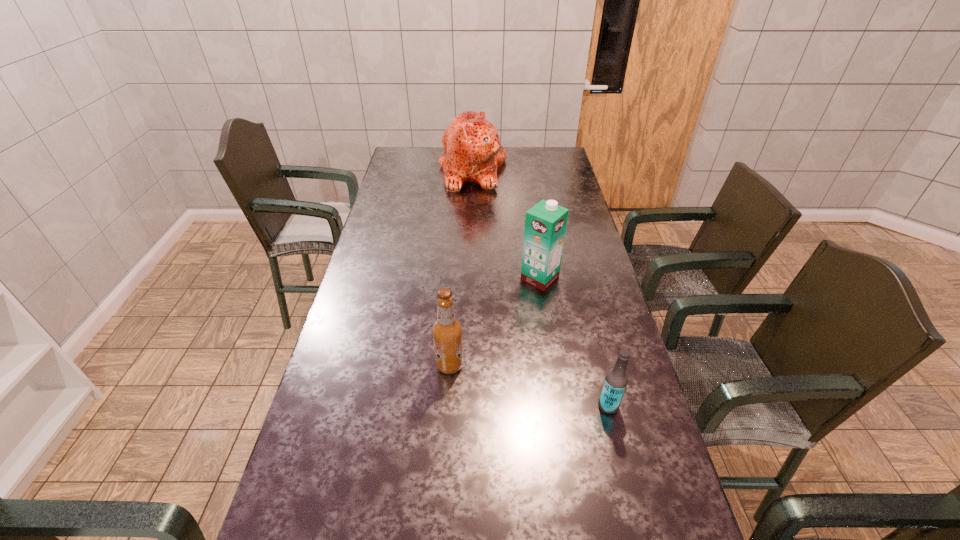
In order to click on empty location between the farthest object and the carton in this screenshot , I will do `click(506, 223)`.

The image size is (960, 540). I want to click on free space between the cat and the second nearest object, so click(x=461, y=267).

The height and width of the screenshot is (540, 960). I want to click on object that is the closest to the left beer bottle, so click(x=545, y=223).

Where is `object that can be found as the second closest to the rightmost object`? object that can be found as the second closest to the rightmost object is located at coordinates (545, 223).

Identify the location of free location that satisfies the following two spatial constraints: 1. on the face of the farthest object; 2. on the right side of the third object from left to right. The width and height of the screenshot is (960, 540). (469, 278).